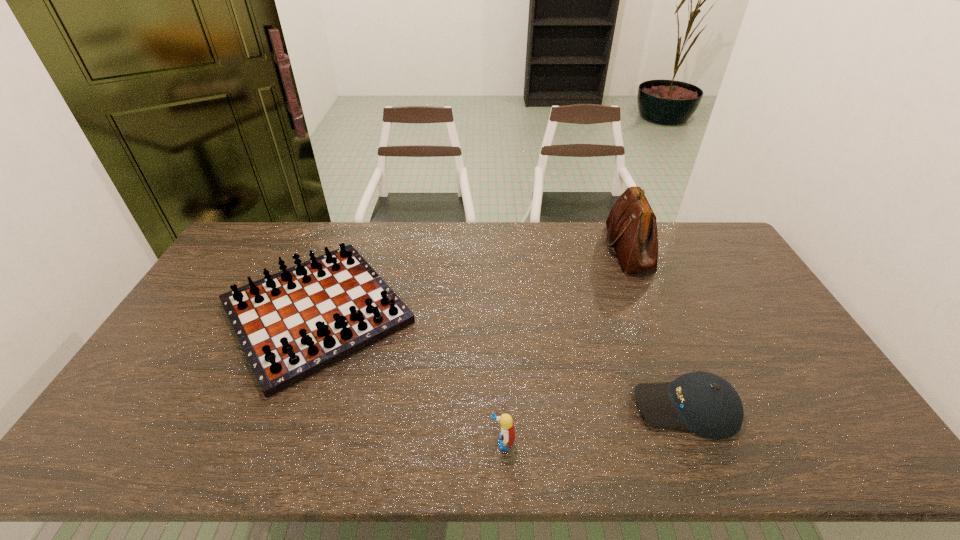
Where is `free location located on the front-facing side of the shortest object`? The image size is (960, 540). free location located on the front-facing side of the shortest object is located at coordinates (487, 407).

What are the coordinates of `vacant region located 0.210m on the front-facing side of the shortest object` in the screenshot? It's located at (550, 407).

Where is `shoulder bag located in the far edge section of the desktop`? This screenshot has width=960, height=540. shoulder bag located in the far edge section of the desktop is located at coordinates pos(631,224).

You are a GUI agent. You are given a task and a screenshot of the screen. Output one action in this format:
    pyautogui.click(x=<x>, y=<y>)
    Task: Click on the chessboard that is at the far edge
    The height and width of the screenshot is (540, 960).
    Given the screenshot: What is the action you would take?
    pyautogui.click(x=292, y=324)

The height and width of the screenshot is (540, 960). In order to click on Lego present at the near edge in this screenshot , I will do `click(507, 436)`.

Identify the location of baseball cap at the near edge. This screenshot has height=540, width=960. (706, 404).

Find the location of `object at the left edge`. object at the left edge is located at coordinates (292, 324).

Where is `object that is positioned at the far left corner`? object that is positioned at the far left corner is located at coordinates (292, 324).

Image resolution: width=960 pixels, height=540 pixels. In order to click on vacant region at the far edge in this screenshot , I will do `click(597, 249)`.

Locate an element on the screen. free space at the left edge is located at coordinates (195, 302).